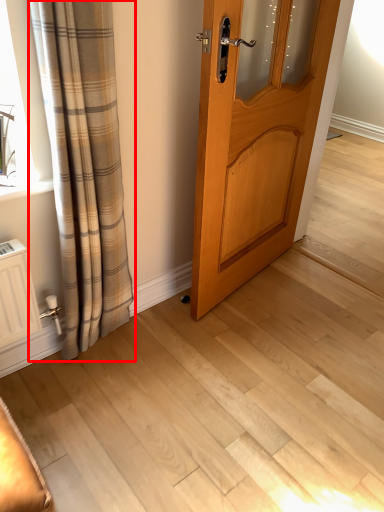
Question: Observing the image, what is the correct spatial positioning of curtain (annotated by the red box) in reference to door?

Choices:
 (A) left
 (B) right

Answer: (A)